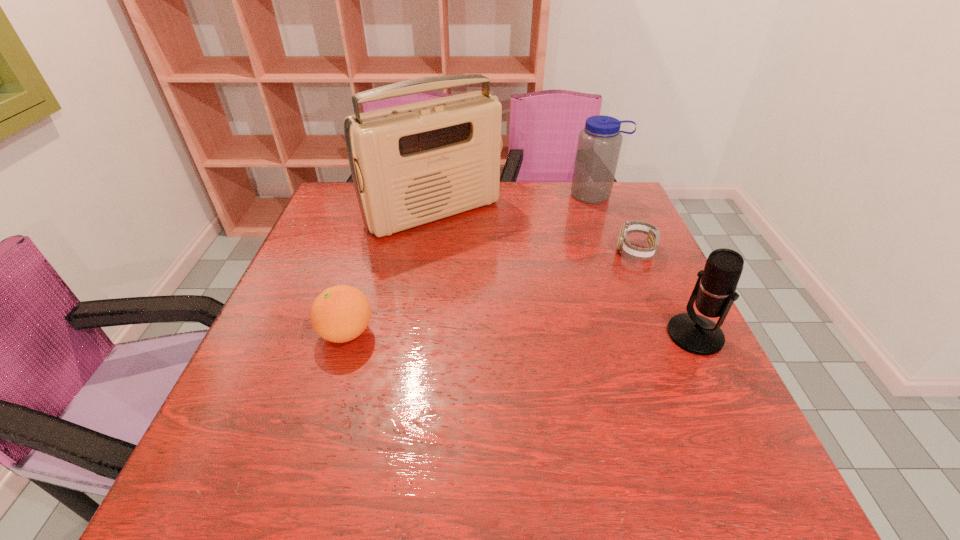
Where is `vacant space located on the face of the watch`? This screenshot has height=540, width=960. vacant space located on the face of the watch is located at coordinates (556, 292).

Locate an element on the screen. vacant space located 0.160m on the face of the watch is located at coordinates (574, 282).

You are a GUI agent. You are given a task and a screenshot of the screen. Output one action in this format:
    pyautogui.click(x=<x>, y=<y>)
    Task: Click on the vacant area situated 0.110m on the face of the watch
    The height and width of the screenshot is (540, 960).
    Given the screenshot: What is the action you would take?
    pyautogui.click(x=589, y=275)

The image size is (960, 540). Find the location of `vacant space situated with a carrying loop on the side of the water bottle`. vacant space situated with a carrying loop on the side of the water bottle is located at coordinates (587, 237).

This screenshot has width=960, height=540. I want to click on vacant space situated with a carrying loop on the side of the water bottle, so click(x=588, y=231).

Locate an element on the screen. Image resolution: width=960 pixels, height=540 pixels. free space located 0.120m with a carrying loop on the side of the water bottle is located at coordinates (588, 227).

Locate an element on the screen. This screenshot has width=960, height=540. radio receiver positioned at the far edge is located at coordinates (412, 164).

The height and width of the screenshot is (540, 960). Identify the location of water bottle that is at the far edge. (599, 143).

Identify the location of orange positioned at the left edge. (341, 313).

This screenshot has height=540, width=960. I want to click on radio receiver that is at the left edge, so click(x=412, y=164).